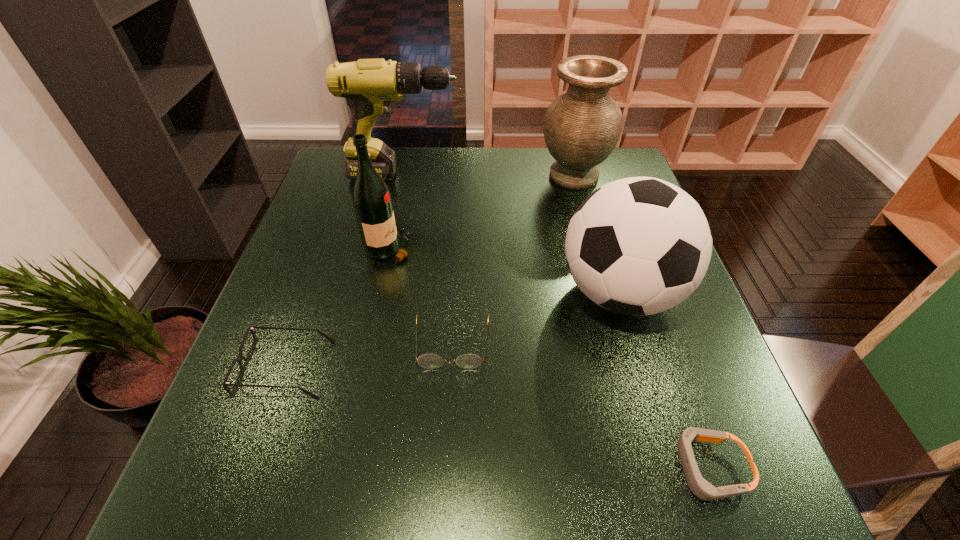
At what (x,y) coordinates should I click in order to perform the action: click on drill. Please return your answer as a coordinate pair (x, y). This screenshot has width=960, height=540. Looking at the image, I should click on (372, 84).

Where is `vase`? The image size is (960, 540). vase is located at coordinates (582, 126).

Identify the location of wine bottle. pos(372,201).

Where is `soccer ball`? The width and height of the screenshot is (960, 540). soccer ball is located at coordinates (637, 246).

Locate an element on the screen. the right spectacles is located at coordinates (469, 361).

The image size is (960, 540). I want to click on the left spectacles, so click(240, 357).

The width and height of the screenshot is (960, 540). In order to click on the nearest object in this screenshot , I will do `click(701, 488)`.

Where is `goggles`? The image size is (960, 540). goggles is located at coordinates (701, 488).

I want to click on blank area located 0.330m on the handle side of the drill, so coord(571,175).

Image resolution: width=960 pixels, height=540 pixels. Identify the location of vacant area situated 0.280m on the left of the vase. (444, 176).